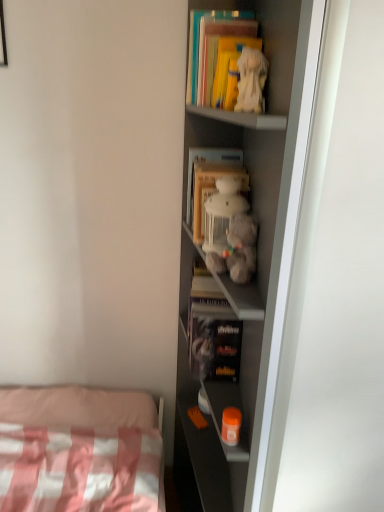
Question: In terms of width, does matte gray shelf at center look wider or thinner when compared to fluffy white teddy bear at center, which is the third toy in bottom-to-top order?

Choices:
 (A) thin
 (B) wide

Answer: (B)

Question: Is point (193, 407) closer or farther from the camera than point (221, 216)?

Choices:
 (A) closer
 (B) farther

Answer: (B)

Question: Estimate the real-world distances between objects in this image. Which object is closer to the hardcover book at center, the first book when ordered from bottom to top?

Choices:
 (A) fluffy gray stuffed animal at center, which is counted as the third toy, starting from the top
 (B) orange plastic container at lower center, which is the first toy in bottom-to-top order
 (C) fluffy white teddy bear at center, which appears as the 2th toy when viewed from the top
 (D) wooden bookshelf at center, the third book in the top-to-bottom sequence
 (E) white plush toy at upper center, the first toy positioned from the top

Answer: (B)

Question: Considering the real-world distances, which object is farthest from the yellow matte book at upper center, which is the second book from top to bottom?

Choices:
 (A) matte gray shelf at center
 (B) orange plastic container at lower center, which is the first toy in bottom-to-top order
 (C) matte yellow book at upper center, which appears as the fourth book when ordered from the bottom
 (D) wooden bookshelf at center, which is the second book in bottom-to-top order
 (E) white plush toy at upper center, the first toy positioned from the top

Answer: (B)